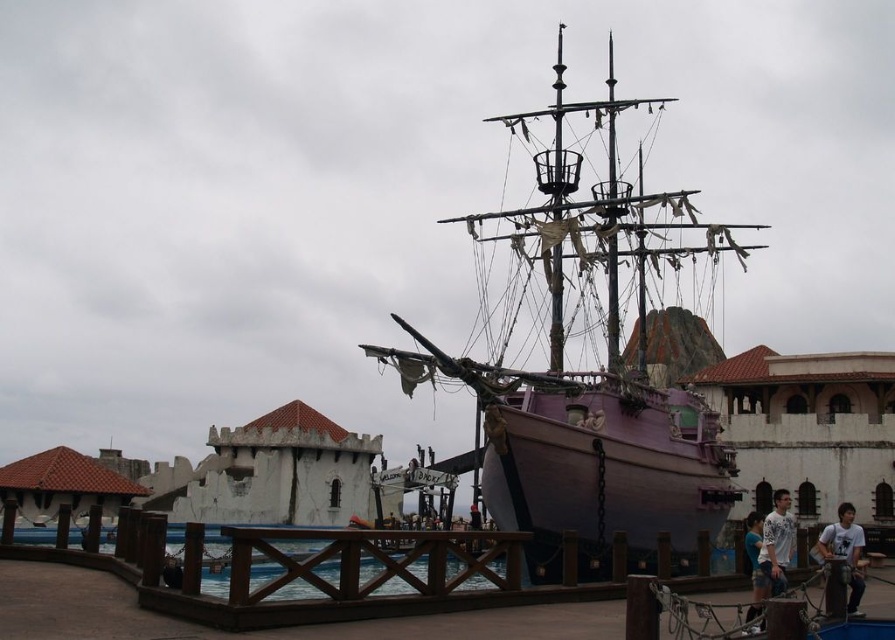
You are standing on the brown wooden dock at center and want to reach the white cotton shirt at lower right. Considering the height difference between them, do you need to climb down or climb up to get there?

The brown wooden dock at center has a greater height compared to the white cotton shirt at lower right, so you need to climb down to reach the white cotton shirt at lower right.

You are standing on the brown wooden dock at center and want to board the purple matte ship at center. Based on the scene, which direction should you move to reach the ship?

The brown wooden dock at center is behind the purple matte ship at center, so you should move forward towards the ship to reach it.

You are a pirate captain standing on the pier and want to board the purple matte ship at center. The light brown wood shirt at lower right is blocking your path. Can you walk around it to reach the ship?

The purple matte ship at center and light brown wood shirt at lower right are 74.40 feet apart from each other, so yes, you can walk around the light brown wood shirt at lower right to reach the purple matte ship at center since there is enough space between them.